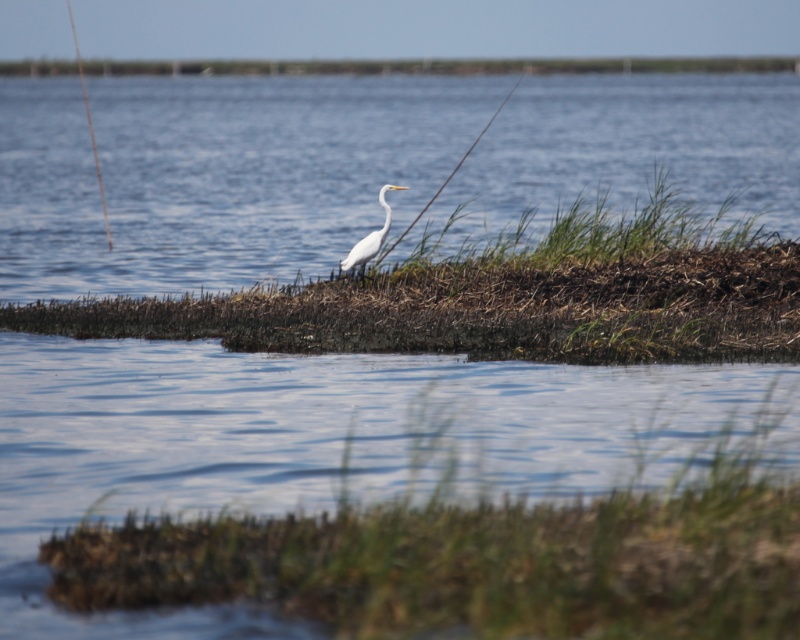
Question: Does green grassy patch at center have a lesser width compared to white matte bird at center?

Choices:
 (A) yes
 (B) no

Answer: (A)

Question: Which of the following is the farthest from the observer?

Choices:
 (A) (362, 244)
 (B) (666, 209)

Answer: (B)

Question: Estimate the real-world distances between objects in this image. Which object is closer to the green grassy patch at center?

Choices:
 (A) white matte bird at center
 (B) green grass at lower center

Answer: (A)

Question: Among these objects, which one is farthest from the camera?

Choices:
 (A) green grassy patch at center
 (B) green grass at lower center
 (C) white matte bird at center

Answer: (C)

Question: Does green grassy patch at center appear on the left side of white matte bird at center?

Choices:
 (A) yes
 (B) no

Answer: (B)

Question: Can you confirm if green grass at lower center is positioned below white matte bird at center?

Choices:
 (A) yes
 (B) no

Answer: (A)